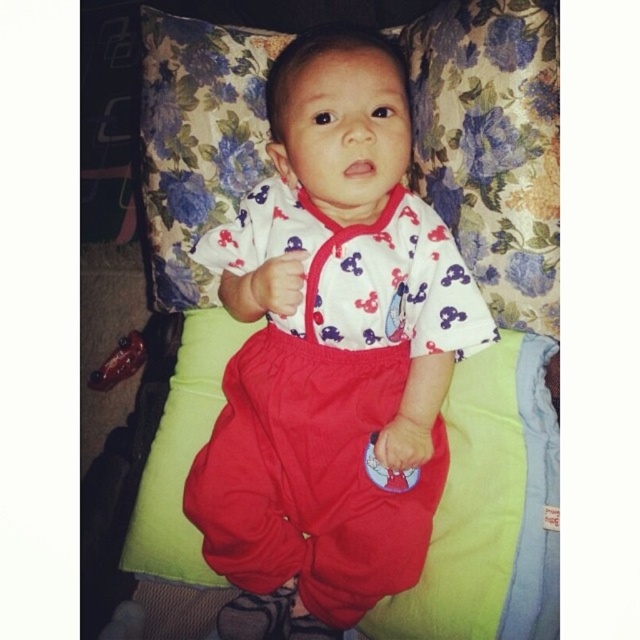
Is matte cotton baby at center wider than floral fabric pillow at upper center?

No, matte cotton baby at center is not wider than floral fabric pillow at upper center.

Is matte cotton baby at center to the right of floral fabric pillow at upper center from the viewer's perspective?

Incorrect, matte cotton baby at center is not on the right side of floral fabric pillow at upper center.

Find the location of a particular element. This screenshot has height=640, width=640. matte cotton baby at center is located at coordinates (333, 348).